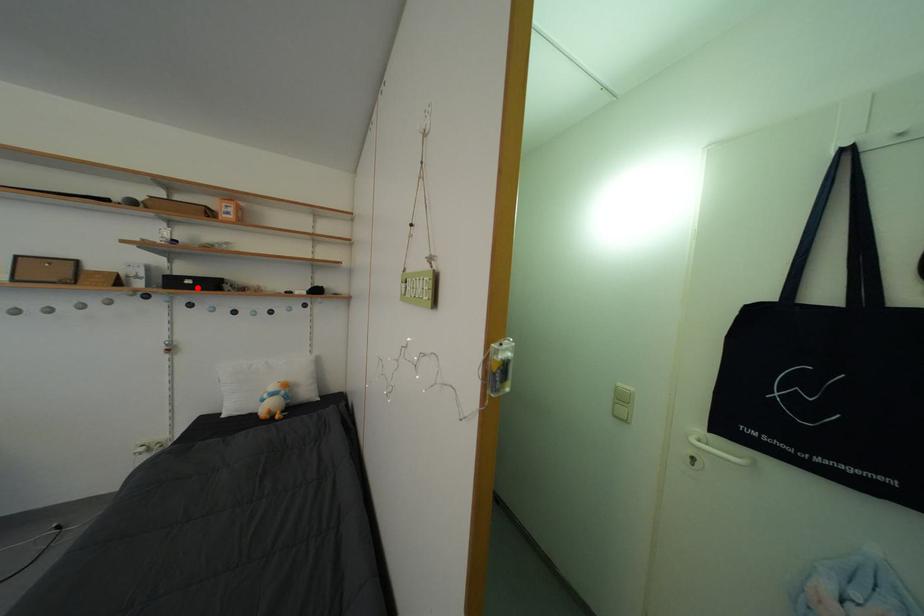
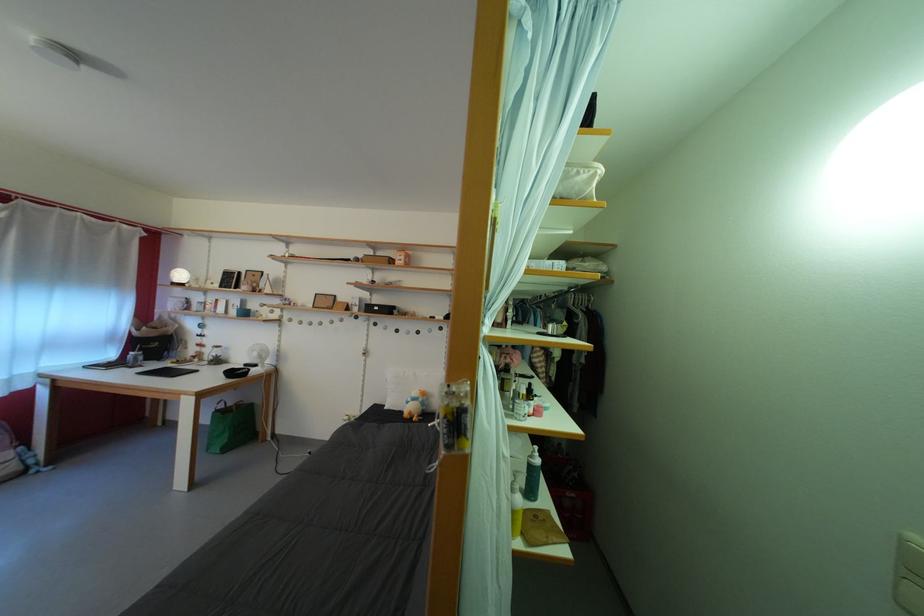
In the second image, find the point that corresponds to the highlighted location in the first image.

(384, 314)